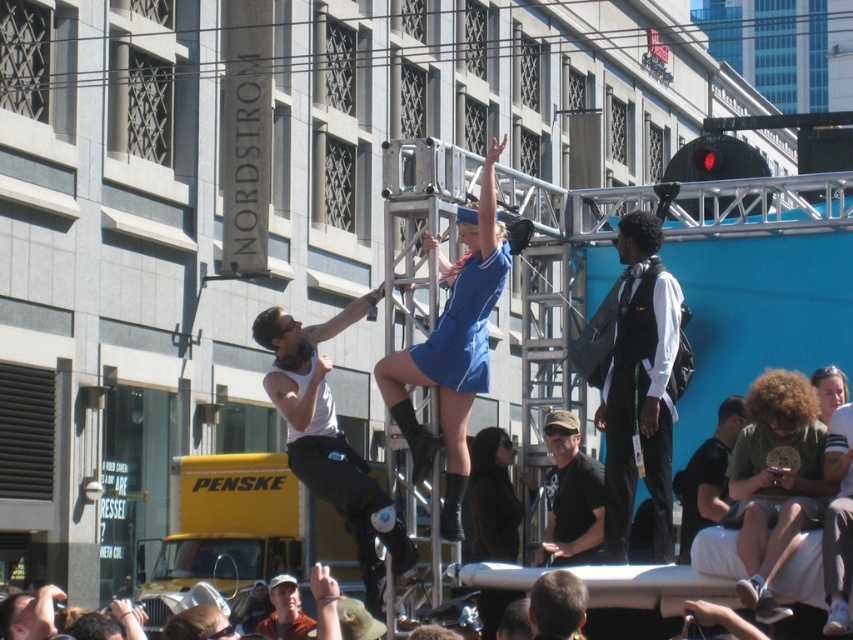
Does white shirt with black vest at center appear over orange t-shirt at lower center?

Indeed, white shirt with black vest at center is positioned over orange t-shirt at lower center.

Between white shirt with black vest at center and orange t-shirt at lower center, which one has less height?

orange t-shirt at lower center is shorter.

This screenshot has width=853, height=640. In order to click on white shirt with black vest at center in this screenshot , I will do `click(640, 387)`.

In the scene shown: Can you confirm if white matte tank top at center is wider than black leather boots at center?

Yes, white matte tank top at center is wider than black leather boots at center.

In the scene shown: Between white matte tank top at center and black leather boots at center, which one is positioned lower?

Positioned lower is black leather boots at center.

Is point (300, 396) closer to viewer compared to point (503, 556)?

That is True.

The height and width of the screenshot is (640, 853). What are the coordinates of `white matte tank top at center` in the screenshot? It's located at (331, 442).

Does black leather boots at center appear under orange t-shirt at lower center?

No, black leather boots at center is not below orange t-shirt at lower center.

Who is shorter, black leather boots at center or orange t-shirt at lower center?

orange t-shirt at lower center

What do you see at coordinates (492, 497) in the screenshot? The width and height of the screenshot is (853, 640). I see `black leather boots at center` at bounding box center [492, 497].

Find the location of a particular element. black leather boots at center is located at coordinates (492, 497).